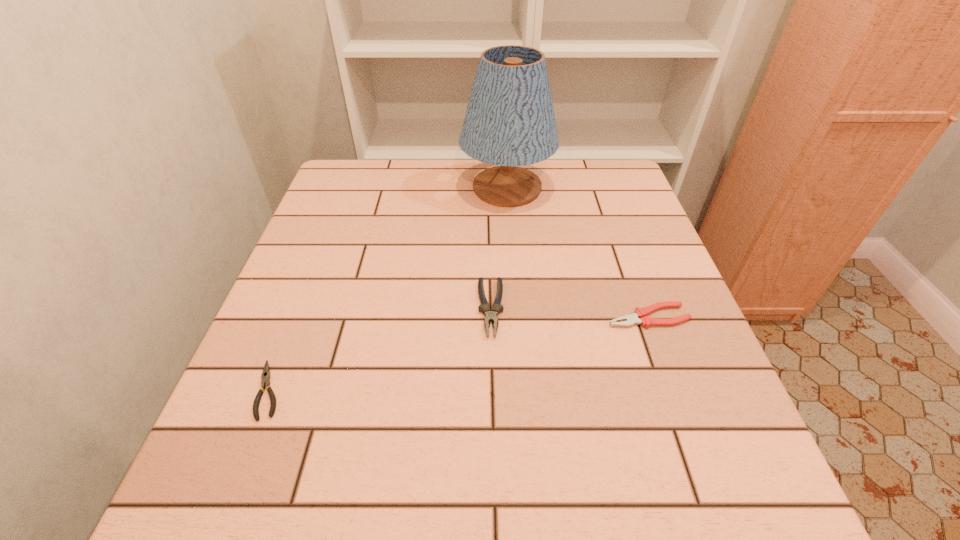
In order to click on free location located 0.350m on the back of the second shortest pliers in this screenshot , I will do `click(609, 206)`.

You are a GUI agent. You are given a task and a screenshot of the screen. Output one action in this format:
    pyautogui.click(x=<x>, y=<y>)
    Task: Click on the vacant region located on the back of the shortest pliers
    The image size is (960, 540).
    Given the screenshot: What is the action you would take?
    pyautogui.click(x=323, y=254)

Locate an element on the screen. The width and height of the screenshot is (960, 540). object located at the far edge is located at coordinates (510, 121).

At what (x,y) coordinates should I click in order to perform the action: click on object situated at the left edge. Please return your answer as a coordinate pair (x, y). The height and width of the screenshot is (540, 960). Looking at the image, I should click on point(266,375).

I want to click on object present at the right edge, so click(639, 316).

Find the location of `blank space at the far edge`. blank space at the far edge is located at coordinates (393, 168).

Image resolution: width=960 pixels, height=540 pixels. Find the location of `free space at the near edge`. free space at the near edge is located at coordinates (460, 498).

Find the location of a particular element. vacant area at the left edge of the desktop is located at coordinates (313, 265).

At what (x,y) coordinates should I click in order to perform the action: click on vacant space at the right edge of the desktop. Please return your answer as a coordinate pair (x, y). Looking at the image, I should click on (601, 208).

The width and height of the screenshot is (960, 540). I want to click on free space at the far left corner of the desktop, so coord(381,185).